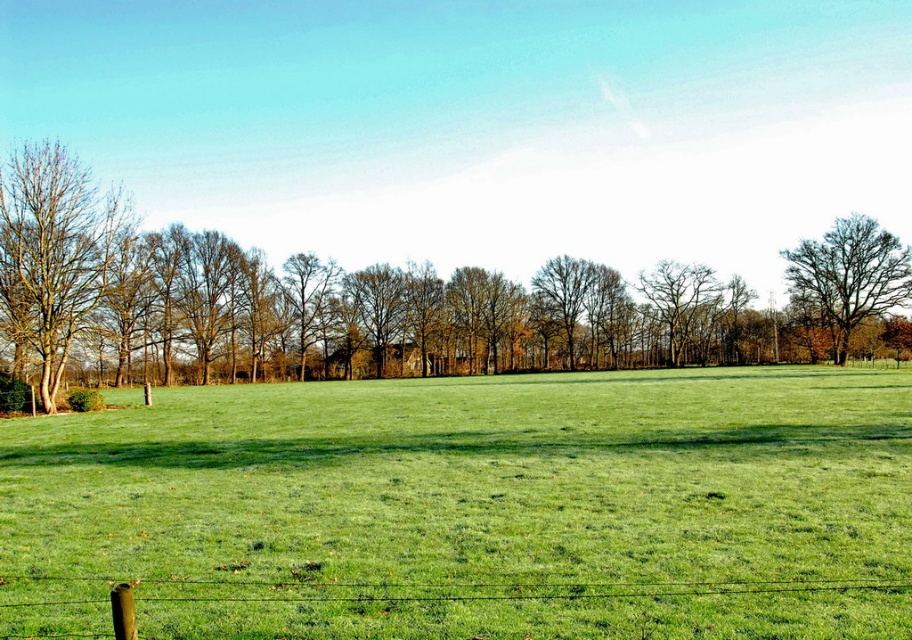
You are a gardener planning to mow the green grassy field at center and the green wire fence at lower left. Which area requires more time to mow?

The green grassy field at center requires more time to mow since it has a larger size compared to the green wire fence at lower left.

You are a bird flying over a rural landscape. You see the brown textured tree at left and the bare brown tree at right. Which tree would block your view of the other tree if you fly directly between them?

The brown textured tree at left is in front of the bare brown tree at right, so if you fly directly between them, the brown textured tree at left would block your view of the bare brown tree at right.

You are standing at the center of the field looking towards the fence. Which tree, the brown leafless tree at left or the bare brown tree at right, is closer to your right side?

The bare brown tree at right is closer to your right side because it is positioned to the right of the brown leafless tree at left.